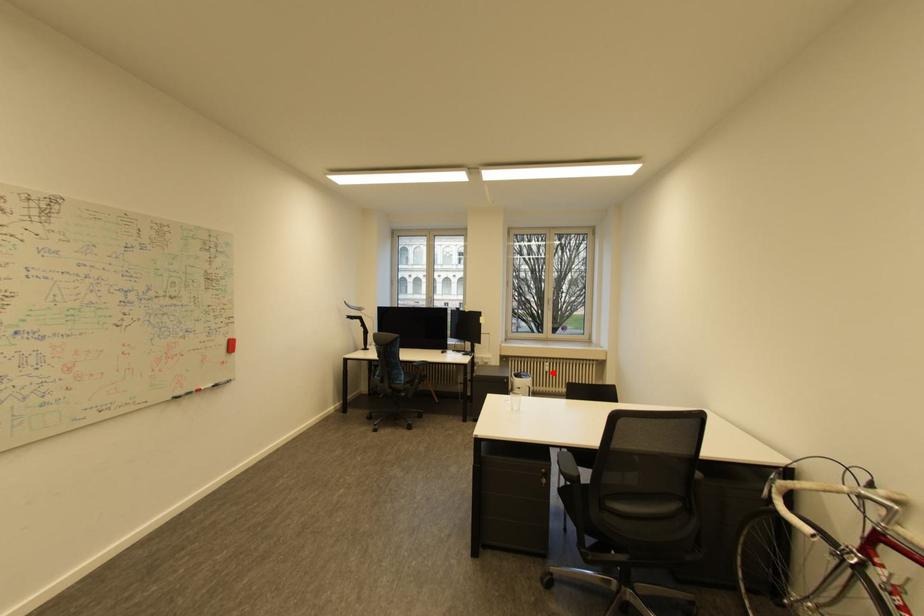
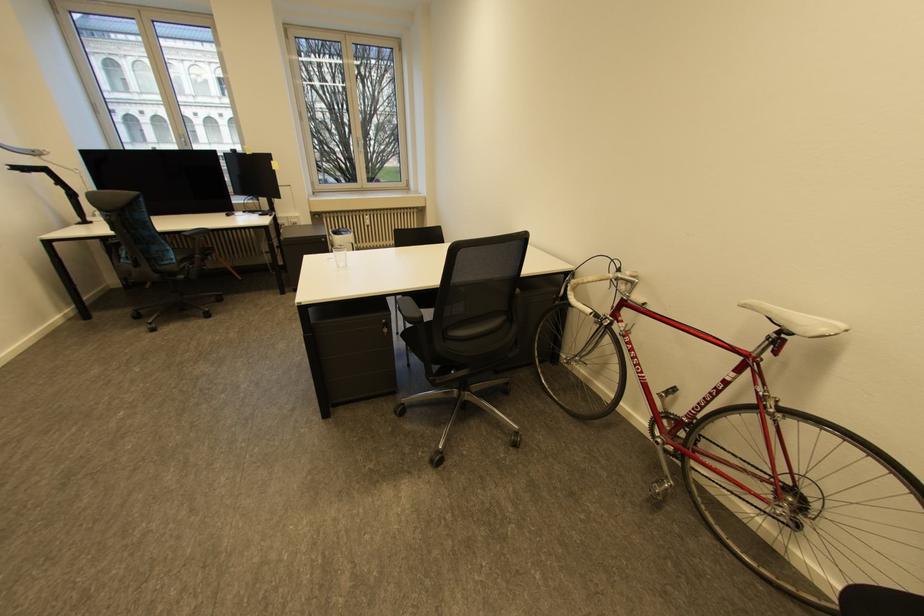
Question: I am providing you with two images of the same scene from different viewpoints. A red point is marked on the first image. At the location where the point appears in image 1, is it still visible in image 2?

Choices:
 (A) Yes
 (B) No

Answer: (A)